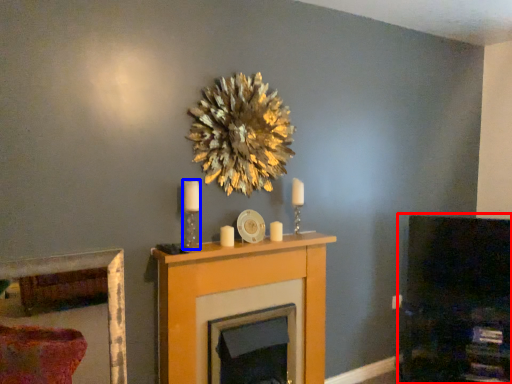
Question: Among these objects, which one is farthest to the camera, dark (highlighted by a red box) or candle holder (highlighted by a blue box)?

Choices:
 (A) dark
 (B) candle holder

Answer: (A)